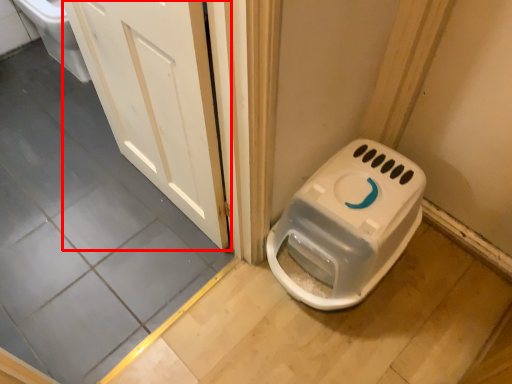
Question: From the image's perspective, where is door (annotated by the red box) located relative to toilet?

Choices:
 (A) above
 (B) below

Answer: (A)